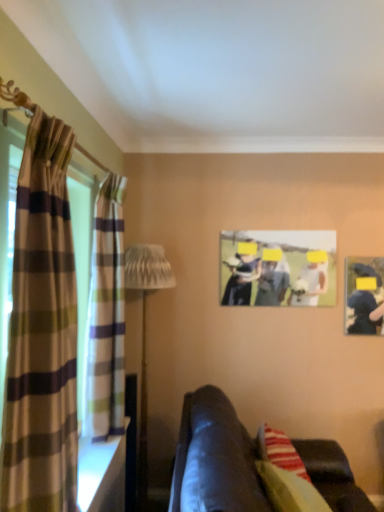
Question: Does plaid fabric curtain at left, positioned as the first curtain in back-to-front order, lie behind plaid fabric curtain at left, the second curtain viewed from the back?

Choices:
 (A) yes
 (B) no

Answer: (A)

Question: Considering the relative sizes of plaid fabric curtain at left, which is counted as the 2th curtain, starting from the front, and plaid fabric curtain at left, which appears as the 1th curtain when viewed from the front, in the image provided, is plaid fabric curtain at left, which is counted as the 2th curtain, starting from the front, thinner than plaid fabric curtain at left, which appears as the 1th curtain when viewed from the front,?

Choices:
 (A) yes
 (B) no

Answer: (B)

Question: Does plaid fabric curtain at left, which is counted as the 2th curtain, starting from the front, have a lesser height compared to plaid fabric curtain at left, which appears as the 1th curtain when viewed from the front?

Choices:
 (A) yes
 (B) no

Answer: (A)

Question: Is plaid fabric curtain at left, which is counted as the 2th curtain, starting from the front, directly adjacent to plaid fabric curtain at left, the second curtain viewed from the back?

Choices:
 (A) no
 (B) yes

Answer: (A)

Question: Is plaid fabric curtain at left, the second curtain viewed from the back, completely or partially inside plaid fabric curtain at left, which is counted as the 2th curtain, starting from the front?

Choices:
 (A) yes
 (B) no

Answer: (B)

Question: Is plaid fabric curtain at left, which is counted as the 2th curtain, starting from the front, to the left of plaid fabric curtain at left, the second curtain viewed from the back, from the viewer's perspective?

Choices:
 (A) no
 (B) yes

Answer: (A)

Question: Can you confirm if plaid fabric curtain at left, the second curtain viewed from the back, is bigger than white textured lamp at left?

Choices:
 (A) yes
 (B) no

Answer: (B)

Question: Would you consider plaid fabric curtain at left, which appears as the 1th curtain when viewed from the front, to be distant from white textured lamp at left?

Choices:
 (A) yes
 (B) no

Answer: (A)

Question: From the image's perspective, is plaid fabric curtain at left, which appears as the 1th curtain when viewed from the front, on white textured lamp at left?

Choices:
 (A) no
 (B) yes

Answer: (B)

Question: Does plaid fabric curtain at left, the second curtain viewed from the back, contain white textured lamp at left?

Choices:
 (A) no
 (B) yes

Answer: (A)

Question: From a real-world perspective, is plaid fabric curtain at left, which appears as the 1th curtain when viewed from the front, positioned over white textured lamp at left based on gravity?

Choices:
 (A) no
 (B) yes

Answer: (B)

Question: Does plaid fabric curtain at left, which appears as the 1th curtain when viewed from the front, have a lesser width compared to white textured lamp at left?

Choices:
 (A) yes
 (B) no

Answer: (A)

Question: From the image's perspective, is white textured lamp at left over plaid fabric curtain at left, which is counted as the 2th curtain, starting from the front?

Choices:
 (A) no
 (B) yes

Answer: (A)